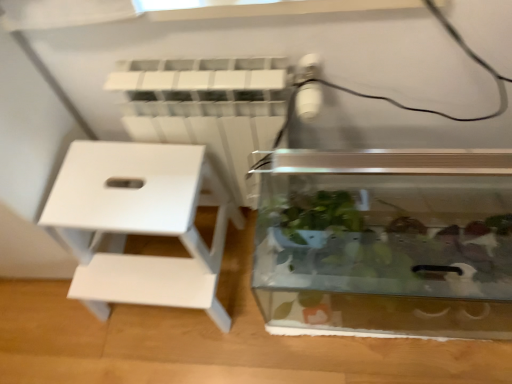
I want to click on transparent glass tank at center, so click(x=386, y=242).

Describe the element at coordinates (206, 107) in the screenshot. This screenshot has width=512, height=384. I see `white plastic radiator at upper center` at that location.

In order to face white matte stool at left, should I rotate leftwards or rightwards?

To face it directly, rotate left by 13.812 degrees.

Find the location of a particular element. The image size is (512, 384). white matte stool at left is located at coordinates pos(140,224).

Find the location of a particular element. This screenshot has width=512, height=384. transparent glass tank at center is located at coordinates (386, 242).

In order to click on furniture above the transparent glass tank at center (from a real-world perspective) in this screenshot , I will do `click(140, 224)`.

Considering the points (354, 289) and (112, 181), which point is in front, point (354, 289) or point (112, 181)?

Positioned in front is point (354, 289).

From a real-world perspective, which object stands above the other?

From a 3D spatial view, white matte stool at left is above.

Which is more to the left, white matte stool at left or transparent glass tank at center?

Positioned to the left is white matte stool at left.

Where is `furniture that is above the transparent glass tank at center (from the image's perspective)`? furniture that is above the transparent glass tank at center (from the image's perspective) is located at coordinates (140, 224).

From a real-world perspective, is white matte stool at left positioned above or below transparent glass tank at center?

In terms of real-world spatial position, white matte stool at left is above transparent glass tank at center.

Between white matte stool at left and transparent glass tank at center, which one has smaller width?

transparent glass tank at center is thinner.

At what (x,y) coordinates should I click in order to perform the action: click on radiator on the right of white matte stool at left. Please return your answer as a coordinate pair (x, y). Looking at the image, I should click on (206, 107).

Does white matte stool at left have a smaller size compared to white plastic radiator at upper center?

No, white matte stool at left is not smaller than white plastic radiator at upper center.

Is white matte stool at left directly adjacent to white plastic radiator at upper center?

No, white matte stool at left is not making contact with white plastic radiator at upper center.

Which is closer to the camera, (275, 96) or (366, 234)?

The point (275, 96) is in front.

Considering their positions, is white plastic radiator at upper center located in front of or behind transparent glass tank at center?

white plastic radiator at upper center is positioned farther from the viewer than transparent glass tank at center.

Is white plastic radiator at upper center inside or outside of transparent glass tank at center?

white plastic radiator at upper center cannot be found inside transparent glass tank at center.

Which of these two, white plastic radiator at upper center or transparent glass tank at center, is bigger?

transparent glass tank at center is bigger.

Looking at this image, is transparent glass tank at center bigger or smaller than white plastic radiator at upper center?

Clearly, transparent glass tank at center is larger in size than white plastic radiator at upper center.

Can you confirm if transparent glass tank at center is wider than white plastic radiator at upper center?

Yes.

Based on their positions, is transparent glass tank at center located to the left or right of white plastic radiator at upper center?

transparent glass tank at center is to the right of white plastic radiator at upper center.

Between transparent glass tank at center and white plastic radiator at upper center, which one has more height?

white plastic radiator at upper center is taller.

Does point (240, 104) come farther from viewer compared to point (92, 219)?

No, (240, 104) is closer to viewer.

Would you say white matte stool at left is part of white plastic radiator at upper center's contents?

That's incorrect, white matte stool at left is not inside white plastic radiator at upper center.

Is white plastic radiator at upper center beside white matte stool at left?

No, white plastic radiator at upper center is not touching white matte stool at left.

Where is `radiator in front of the white matte stool at left`? The width and height of the screenshot is (512, 384). radiator in front of the white matte stool at left is located at coordinates (206, 107).

You are a GUI agent. You are given a task and a screenshot of the screen. Output one action in this format:
    pyautogui.click(x=<x>, y=<y>)
    Task: Click on the glass box in front of the white matte stool at left
    
    Given the screenshot: What is the action you would take?
    pyautogui.click(x=386, y=242)

What are the coordinates of `furniture above the transparent glass tank at center (from a real-world perspective)` in the screenshot? It's located at (140, 224).

When comparing their distances from white plastic radiator at upper center, does white matte stool at left or transparent glass tank at center seem closer?

white matte stool at left lies closer to white plastic radiator at upper center than the other object.

From the image, which object appears to be nearer to transparent glass tank at center, white plastic radiator at upper center or white matte stool at left?

The object closer to transparent glass tank at center is white plastic radiator at upper center.

Estimate the real-world distances between objects in this image. Which object is further from white matte stool at left, white plastic radiator at upper center or transparent glass tank at center?

The object further to white matte stool at left is transparent glass tank at center.

From the image, which object appears to be nearer to transparent glass tank at center, white matte stool at left or white plastic radiator at upper center?

Based on the image, white plastic radiator at upper center appears to be nearer to transparent glass tank at center.

When comparing their distances from white plastic radiator at upper center, does transparent glass tank at center or white matte stool at left seem closer?

Based on the image, white matte stool at left appears to be nearer to white plastic radiator at upper center.

Considering their positions, is transparent glass tank at center positioned closer to white matte stool at left than white plastic radiator at upper center?

white plastic radiator at upper center is positioned closer to the anchor white matte stool at left.

You are a GUI agent. You are given a task and a screenshot of the screen. Output one action in this format:
    pyautogui.click(x=<x>, y=<y>)
    Task: Click on the radiator between white matte stool at left and transparent glass tank at center in the horizontal direction
    The width and height of the screenshot is (512, 384).
    Given the screenshot: What is the action you would take?
    pyautogui.click(x=206, y=107)